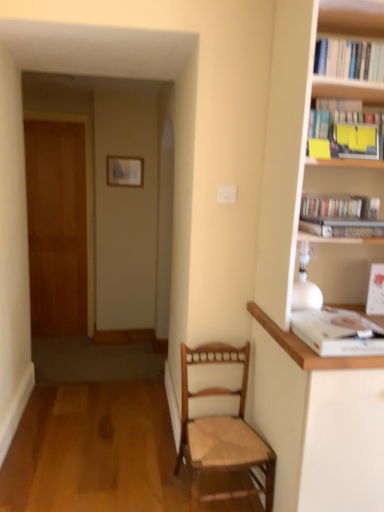
This screenshot has width=384, height=512. I want to click on empty space that is ontop of yellow paper at upper right, which appears as the fourth book when ordered from the bottom (from a real-world perspective), so click(350, 95).